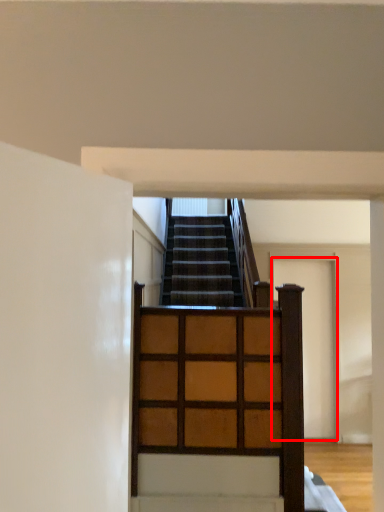
Question: From the image's perspective, where is door (annotated by the red box) located in relation to dresser in the image?

Choices:
 (A) below
 (B) above

Answer: (A)